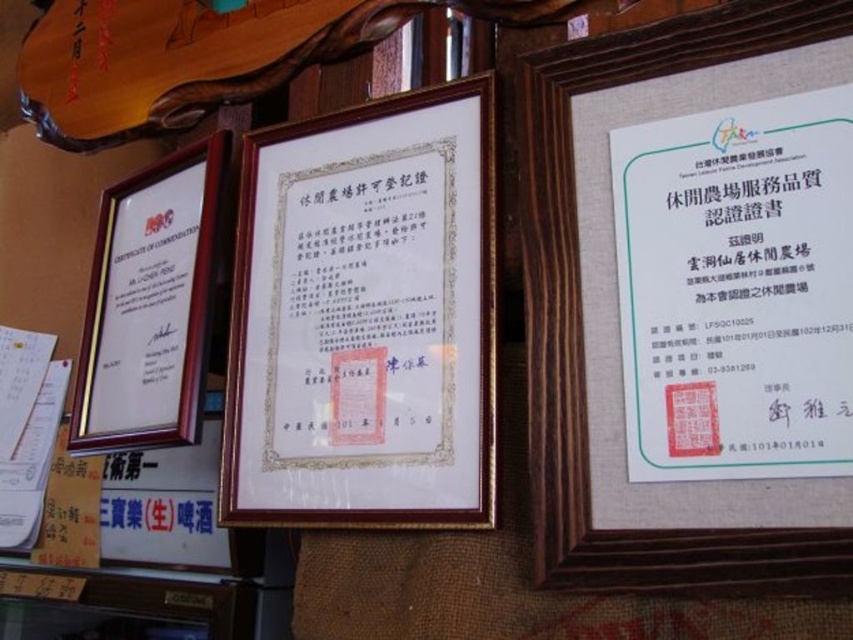
What do you see at coordinates (364, 317) in the screenshot? I see `wooden frame at center` at bounding box center [364, 317].

Can you confirm if wooden frame at center is bigger than wooden picture frame at left?

Indeed, wooden frame at center has a larger size compared to wooden picture frame at left.

This screenshot has width=853, height=640. What do you see at coordinates (364, 317) in the screenshot?
I see `wooden frame at center` at bounding box center [364, 317].

Identify the location of wooden frame at center. The width and height of the screenshot is (853, 640). (364, 317).

Which is in front, point (750, 218) or point (143, 273)?

Point (750, 218)

Is point (779, 100) less distant than point (138, 248)?

Yes, it is.

This screenshot has width=853, height=640. Find the location of `white paper certificate at center`. white paper certificate at center is located at coordinates (735, 289).

Which is below, white paper certificate at center or wooden frame at upper center?

wooden frame at upper center

Is white paper certificate at center wider than wooden frame at upper center?

In fact, white paper certificate at center might be narrower than wooden frame at upper center.

Between point (628, 252) and point (679, 563), which one is positioned behind?

Positioned behind is point (628, 252).

Locate an element on the screen. The width and height of the screenshot is (853, 640). white paper certificate at center is located at coordinates (735, 289).